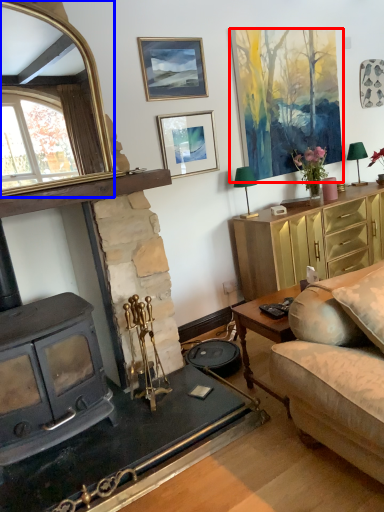
Question: Which object is closer to the camera taking this photo, picture frame (highlighted by a red box) or mirror (highlighted by a blue box)?

Choices:
 (A) picture frame
 (B) mirror

Answer: (B)